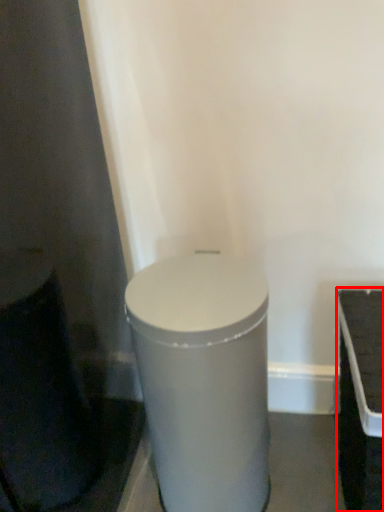
Question: Considering the relative positions of table (annotated by the red box) and waste container in the image provided, where is table (annotated by the red box) located with respect to the staircase?

Choices:
 (A) right
 (B) left

Answer: (A)